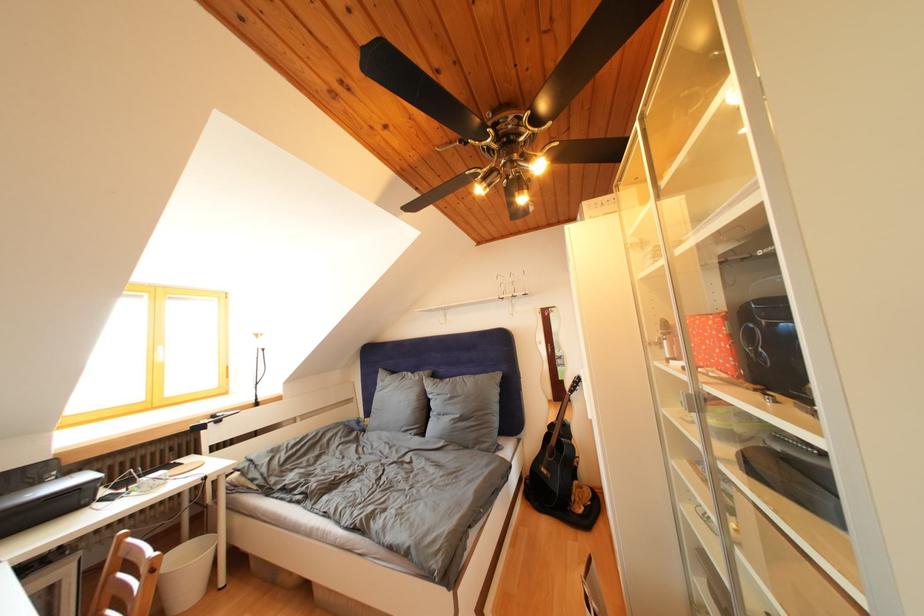
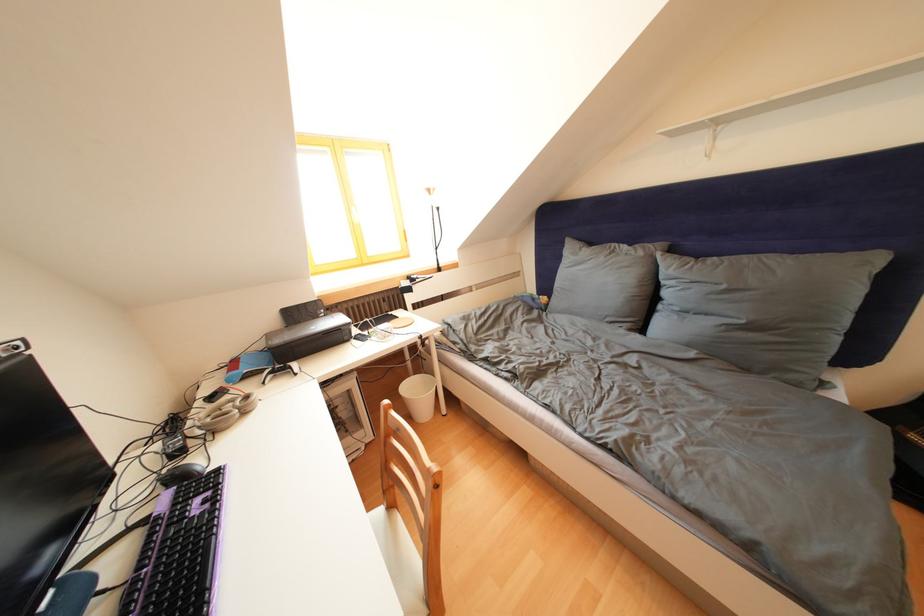
The point at (x=457, y=400) is marked in the first image. Where is the corresponding point in the second image?

(733, 292)